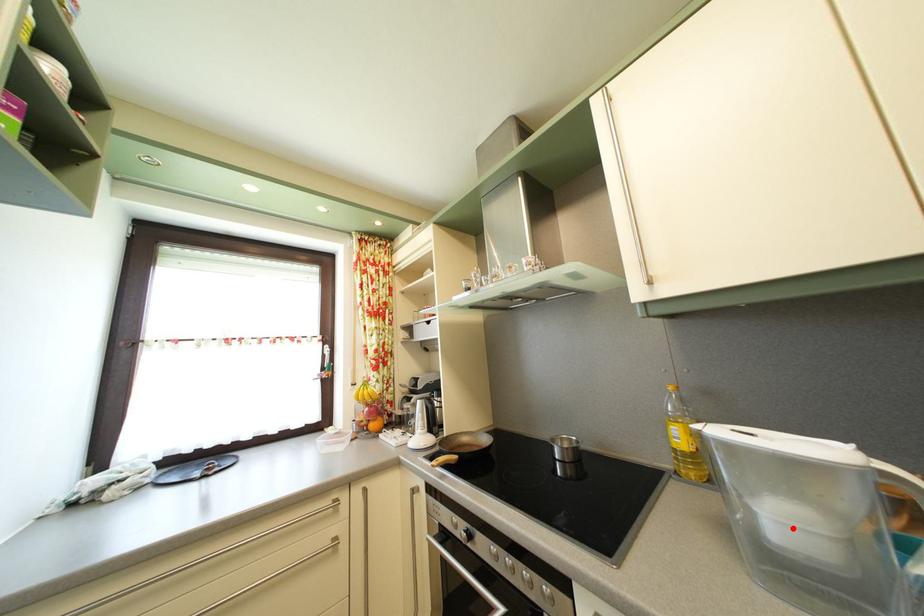
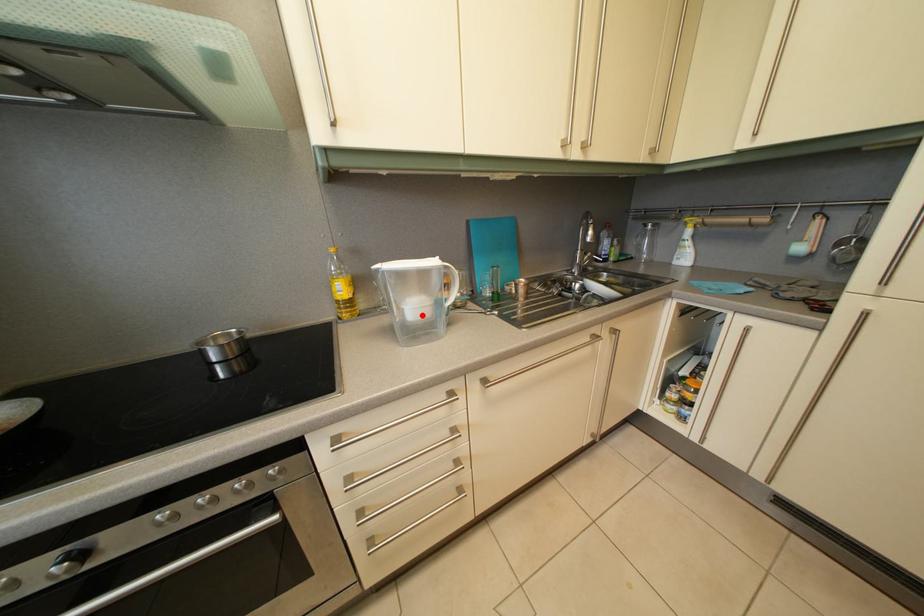
I am providing you with two images of the same scene from different viewpoints. A red point is marked on the first image and another point is marked on the second image. Do the highlighted points in image1 and image2 indicate the same real-world spot?

Yes